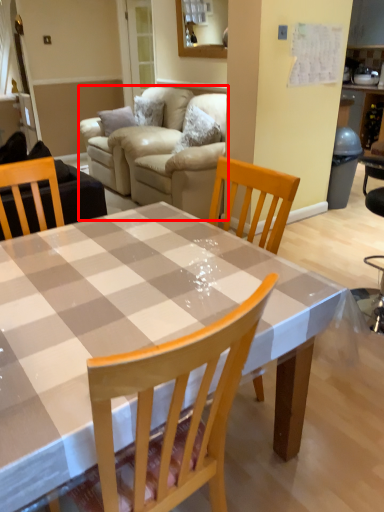
Question: In this image, where is studio couch (annotated by the red box) located relative to kitchen & dining room table?

Choices:
 (A) left
 (B) right

Answer: (A)